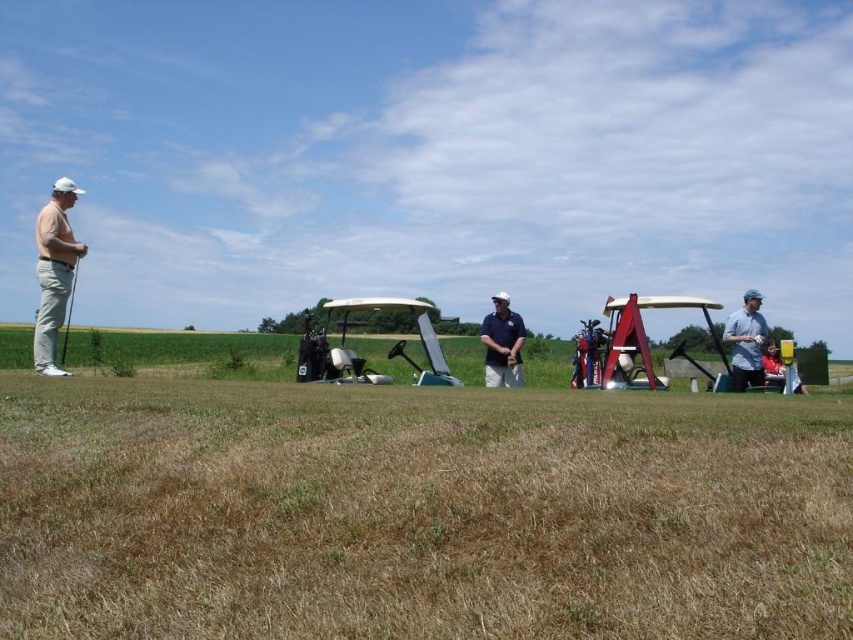
Question: Which point is farther to the camera?

Choices:
 (A) (73, 275)
 (B) (47, 340)
 (C) (485, 324)

Answer: (C)

Question: Estimate the real-world distances between objects in this image. Which object is closer to the blue cotton polo shirt at center?

Choices:
 (A) matte white golf club at left
 (B) metallic silver golf cart at center right
 (C) blue cotton shirt at right

Answer: (B)

Question: Does brown grass at center have a larger size compared to blue cotton polo shirt at center?

Choices:
 (A) no
 (B) yes

Answer: (A)

Question: Which point is closer to the camera taking this photo?

Choices:
 (A) tap(642, 323)
 (B) tap(422, 314)
 (C) tap(767, 356)

Answer: (A)

Question: Does red fabric shirt at right have a greater width compared to matte black golf club at left?

Choices:
 (A) yes
 (B) no

Answer: (B)

Question: Is white plastic golf cart at center below blue cotton shirt at right?

Choices:
 (A) yes
 (B) no

Answer: (A)